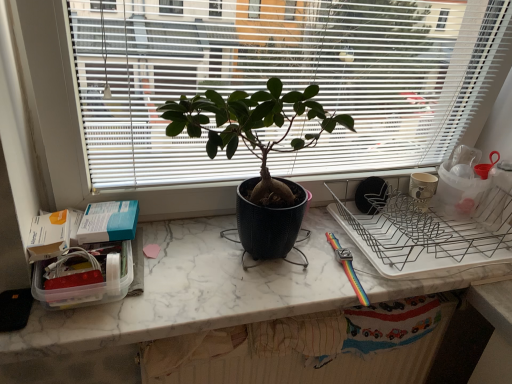
Question: Looking at the image, does matte black plant at center seem bigger or smaller compared to matte black pot at center?

Choices:
 (A) big
 (B) small

Answer: (A)

Question: Does point (84, 127) appear closer or farther from the camera than point (274, 246)?

Choices:
 (A) farther
 (B) closer

Answer: (B)

Question: Which object is positioned farthest from the matte black pot at center?

Choices:
 (A) matte black plant at center
 (B) white marble countertop at center

Answer: (B)

Question: Which is nearer to the white marble countertop at center?

Choices:
 (A) matte black plant at center
 (B) matte black pot at center

Answer: (B)